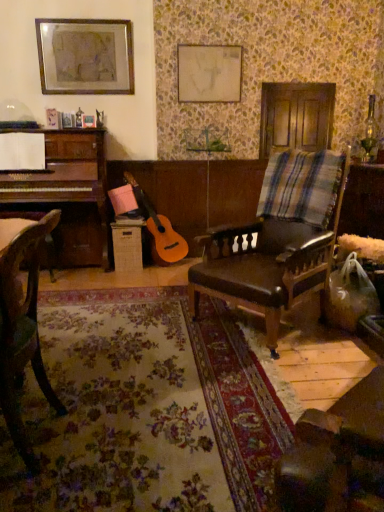
The height and width of the screenshot is (512, 384). I want to click on brown leather chair at center, which is the first chair in back-to-front order, so coord(278,238).

Where is `wooden chair at left, which is counted as the first chair, starting from the front`? The width and height of the screenshot is (384, 512). wooden chair at left, which is counted as the first chair, starting from the front is located at coordinates (22, 329).

In order to face wooden chair at left, acting as the second chair starting from the right, should I rotate leftwards or rightwards?

Turn left by 22.539 degrees to look at wooden chair at left, acting as the second chair starting from the right.

What do you see at coordinates (209, 73) in the screenshot?
I see `matte white canvas at upper center, which appears as the 1th picture frame when viewed from the right` at bounding box center [209, 73].

You are a GUI agent. You are given a task and a screenshot of the screen. Output one action in this format:
    pyautogui.click(x=<x>, y=<y>)
    Task: Click on the metallic silver picture frame at upper left, the 2th picture frame viewed from the right
    Image resolution: width=384 pixels, height=512 pixels.
    Given the screenshot: What is the action you would take?
    pyautogui.click(x=85, y=56)

Is wooden chair at left, which is counted as the first chair, starting from the front, looking in the opposite direction of plaid fabric at right?

No.

From a real-world perspective, is wooden chair at left, acting as the second chair starting from the right, on top of plaid fabric at right?

No, from a real-world perspective, wooden chair at left, acting as the second chair starting from the right, is not over plaid fabric at right

Measure the distance between wooden chair at left, which is the 1th chair from left to right, and plaid fabric at right.

They are 1.61 meters apart.

Does brown leather chair at center, the 2th chair when ordered from left to right, have a lesser height compared to metallic silver picture frame at upper left, which ranks as the first picture frame in left-to-right order?

Incorrect, the height of brown leather chair at center, the 2th chair when ordered from left to right, does not fall short of that of metallic silver picture frame at upper left, which ranks as the first picture frame in left-to-right order.

Is brown leather chair at center, marked as the first chair in a right-to-left arrangement, beside metallic silver picture frame at upper left, the 2th picture frame viewed from the right?

No, brown leather chair at center, marked as the first chair in a right-to-left arrangement, is not in contact with metallic silver picture frame at upper left, the 2th picture frame viewed from the right.

From the image's perspective, is brown leather chair at center, which ranks as the second chair in front-to-back order, located above or below metallic silver picture frame at upper left, which ranks as the first picture frame in left-to-right order?

Based on their image positions, brown leather chair at center, which ranks as the second chair in front-to-back order, is located beneath metallic silver picture frame at upper left, which ranks as the first picture frame in left-to-right order.

Does point (264, 193) lie behind point (193, 309)?

Yes, it is.

How far apart are plaid fabric at right and brown leather chair at center, which ranks as the second chair in front-to-back order?

6.49 inches.

From a real-world perspective, does plaid fabric at right sit lower than brown leather chair at center, which is the first chair in back-to-front order?

No.

From the picture: Who is shorter, plaid fabric at right or brown leather chair at center, which ranks as the second chair in front-to-back order?

Standing shorter between the two is plaid fabric at right.

From a real-world perspective, who is located lower, brown leather chair at center, which is the first chair in back-to-front order, or plaid fabric at right?

In real-world perspective, brown leather chair at center, which is the first chair in back-to-front order, is lower.

Can you confirm if brown leather chair at center, which ranks as the second chair in front-to-back order, is thinner than plaid fabric at right?

In fact, brown leather chair at center, which ranks as the second chair in front-to-back order, might be wider than plaid fabric at right.

Is plaid fabric at right completely or partially inside brown leather chair at center, marked as the first chair in a right-to-left arrangement?

Yes.

Which is behind, point (221, 51) or point (274, 164)?

Positioned behind is point (221, 51).

Considering the relative sizes of matte white canvas at upper center, the 2th picture frame when ordered from left to right, and plaid fabric at right in the image provided, is matte white canvas at upper center, the 2th picture frame when ordered from left to right, taller than plaid fabric at right?

Yes, matte white canvas at upper center, the 2th picture frame when ordered from left to right, is taller than plaid fabric at right.

Identify the location of plaid below the matte white canvas at upper center, which appears as the 1th picture frame when viewed from the right (from the image's perspective). (302, 186).

Is matte white canvas at upper center, the 2th picture frame when ordered from left to right, to the right of plaid fabric at right from the viewer's perspective?

In fact, matte white canvas at upper center, the 2th picture frame when ordered from left to right, is to the left of plaid fabric at right.

Find the location of a particular element. the 2nd chair in front of the matte white canvas at upper center, which appears as the 1th picture frame when viewed from the right, starting your count from the anchor is located at coordinates (22, 329).

Considering the relative sizes of matte white canvas at upper center, which appears as the 1th picture frame when viewed from the right, and wooden chair at left, which is the 1th chair from left to right, in the image provided, is matte white canvas at upper center, which appears as the 1th picture frame when viewed from the right, taller than wooden chair at left, which is the 1th chair from left to right,?

Incorrect, the height of matte white canvas at upper center, which appears as the 1th picture frame when viewed from the right, is not larger of that of wooden chair at left, which is the 1th chair from left to right.

What's the angular difference between matte white canvas at upper center, which appears as the 1th picture frame when viewed from the right, and wooden chair at left, which is the 1th chair from left to right,'s facing directions?

95.7 degrees separate the facing orientations of matte white canvas at upper center, which appears as the 1th picture frame when viewed from the right, and wooden chair at left, which is the 1th chair from left to right.

Choose the correct answer: Is matte white canvas at upper center, which appears as the 1th picture frame when viewed from the right, inside wooden chair at left, which is counted as the first chair, starting from the front, or outside it?

matte white canvas at upper center, which appears as the 1th picture frame when viewed from the right, exists outside the volume of wooden chair at left, which is counted as the first chair, starting from the front.

Considering the positions of objects plaid fabric at right and metallic silver picture frame at upper left, the 2th picture frame viewed from the right, in the image provided, who is behind, plaid fabric at right or metallic silver picture frame at upper left, the 2th picture frame viewed from the right,?

Positioned behind is metallic silver picture frame at upper left, the 2th picture frame viewed from the right.

Consider the image. Is plaid fabric at right surrounding metallic silver picture frame at upper left, the 2th picture frame viewed from the right?

Definitely not — metallic silver picture frame at upper left, the 2th picture frame viewed from the right, is not inside plaid fabric at right.

From the image's perspective, which object appears higher, plaid fabric at right or metallic silver picture frame at upper left, which ranks as the first picture frame in left-to-right order?

From the image's view, metallic silver picture frame at upper left, which ranks as the first picture frame in left-to-right order, is above.

Does plaid fabric at right have a larger size compared to metallic silver picture frame at upper left, the 2th picture frame viewed from the right?

Yes.

Find the location of a particular element. The height and width of the screenshot is (512, 384). chair that is the 2nd object directly below the plaid fabric at right (from a real-world perspective) is located at coordinates (22, 329).

From the image's perspective, count 1st chairs downward from the metallic silver picture frame at upper left, the 2th picture frame viewed from the right, and point to it. Please provide its 2D coordinates.

[(278, 238)]

Which object lies nearer to the anchor point brown leather chair at center, which is the first chair in back-to-front order, plaid fabric at right or wooden chair at left, acting as the second chair starting from the right?

Among the two, plaid fabric at right is located nearer to brown leather chair at center, which is the first chair in back-to-front order.

Considering their positions, is matte white canvas at upper center, the 2th picture frame when ordered from left to right, positioned further to brown leather chair at center, which is the first chair in back-to-front order, than wooden chair at left, which is counted as the first chair, starting from the front?

matte white canvas at upper center, the 2th picture frame when ordered from left to right, lies further to brown leather chair at center, which is the first chair in back-to-front order, than the other object.

Which object lies further to the anchor point brown leather chair at center, which ranks as the second chair in front-to-back order, plaid fabric at right or metallic silver picture frame at upper left, the 2th picture frame viewed from the right?

metallic silver picture frame at upper left, the 2th picture frame viewed from the right, lies further to brown leather chair at center, which ranks as the second chair in front-to-back order, than the other object.

Based on their spatial positions, is matte white canvas at upper center, the 2th picture frame when ordered from left to right, or plaid fabric at right closer to wooden chair at left, acting as the second chair starting from the right?

plaid fabric at right is closer to wooden chair at left, acting as the second chair starting from the right.

Looking at the image, which one is located closer to metallic silver picture frame at upper left, which ranks as the first picture frame in left-to-right order, plaid fabric at right or wooden chair at left, which is the 1th chair from left to right?

plaid fabric at right.

Which object lies further to the anchor point wooden chair at left, the second chair viewed from the back, metallic silver picture frame at upper left, the 2th picture frame viewed from the right, or brown leather chair at center, which ranks as the second chair in front-to-back order?

metallic silver picture frame at upper left, the 2th picture frame viewed from the right.

From the image, which object appears to be nearer to wooden chair at left, acting as the second chair starting from the right, plaid fabric at right or matte white canvas at upper center, the 2th picture frame when ordered from left to right?

Among the two, plaid fabric at right is located nearer to wooden chair at left, acting as the second chair starting from the right.

Which object lies further to the anchor point plaid fabric at right, wooden chair at left, which is counted as the first chair, starting from the front, or brown leather chair at center, which is the first chair in back-to-front order?

wooden chair at left, which is counted as the first chair, starting from the front, is positioned further to the anchor plaid fabric at right.

You are a GUI agent. You are given a task and a screenshot of the screen. Output one action in this format:
    pyautogui.click(x=<x>, y=<y>)
    Task: Click on the picture frame positioned between brown leather chair at center, the 2th chair when ordered from left to right, and matte white canvas at upper center, the 2th picture frame when ordered from left to right, from near to far
    This screenshot has height=512, width=384.
    Given the screenshot: What is the action you would take?
    pyautogui.click(x=85, y=56)

Locate an element on the screen. plaid between brown leather chair at center, the 2th chair when ordered from left to right, and matte white canvas at upper center, the 2th picture frame when ordered from left to right, along the z-axis is located at coordinates (302, 186).

At what (x,y) coordinates should I click in order to perform the action: click on picture frame between wooden chair at left, which is the 1th chair from left to right, and matte white canvas at upper center, which appears as the 1th picture frame when viewed from the right, along the z-axis. Please return your answer as a coordinate pair (x, y). Looking at the image, I should click on (85, 56).

Identify the location of chair positioned between wooden chair at left, which is the 1th chair from left to right, and matte white canvas at upper center, the 2th picture frame when ordered from left to right, from near to far. (278, 238).